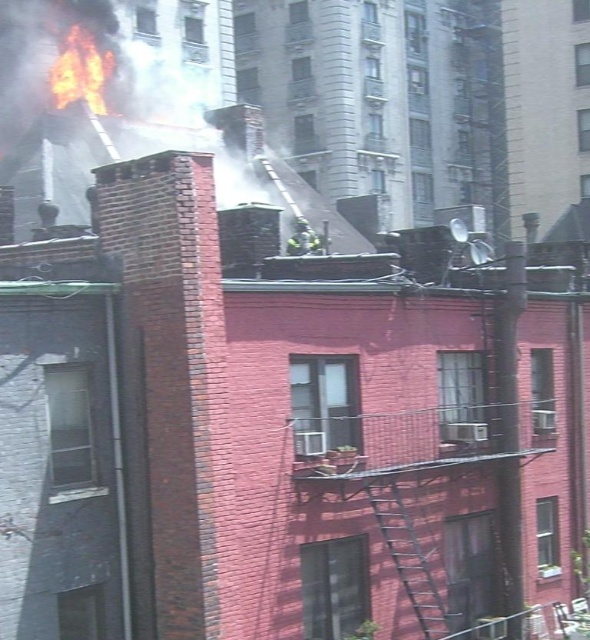
You are a firefighter trying to reach the flames. Given the fire escape ladder is on the right side of the building, which direction should you go from the green reflective uniform at center to reach the flaming orange flames at upper left?

The flaming orange flames at upper left are to the left of the green reflective uniform at center, so you should move to the left to reach them.

You are a firefighter trying to reach the roof to extinguish the fire. There is a metallic silver ladder at center. Based on its position coordinates, can you estimate whether it is placed in a suitable location to climb onto the roof?

The metallic silver ladder at center is positioned at coordinates point (407,556), which is likely close enough to the building to allow safe access to the roof for firefighting efforts.

You are a firefighter trying to reach the flames coming from the chimney. You have a metallic silver ladder at center and a green reflective uniform at center. Which object should you move to the left to get a better angle to tackle the fire?

The metallic silver ladder at center is positioned on the right side of green reflective uniform at center. To get a better angle, you should move the metallic silver ladder at center to the left so it is no longer blocking the path of the green reflective uniform at center.